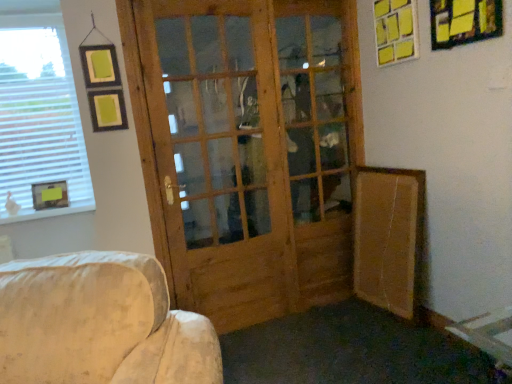
Question: Can you confirm if yellow paper picture frame at upper right, positioned as the second picture frame in bottom-to-top order, is smaller than white blinds at left?

Choices:
 (A) no
 (B) yes

Answer: (B)

Question: Is yellow paper picture frame at upper right, placed as the 1th picture frame when sorted from right to left, positioned in front of white blinds at left?

Choices:
 (A) yes
 (B) no

Answer: (A)

Question: Would you say yellow paper picture frame at upper right, positioned as the 1th picture frame in front-to-back order, is outside white blinds at left?

Choices:
 (A) no
 (B) yes

Answer: (B)

Question: From a real-world perspective, is yellow paper picture frame at upper right, placed as the 1th picture frame when sorted from right to left, beneath white blinds at left?

Choices:
 (A) no
 (B) yes

Answer: (A)

Question: Are yellow paper picture frame at upper right, positioned as the 1th picture frame in front-to-back order, and white blinds at left located far from each other?

Choices:
 (A) no
 (B) yes

Answer: (B)

Question: Does yellow paper picture frame at upper right, positioned as the second picture frame in bottom-to-top order, have a larger size compared to white blinds at left?

Choices:
 (A) yes
 (B) no

Answer: (B)

Question: From a real-world perspective, is natural wood screen door at center over brown cardboard at lower right?

Choices:
 (A) yes
 (B) no

Answer: (A)

Question: From the image's perspective, does natural wood screen door at center appear lower than brown cardboard at lower right?

Choices:
 (A) yes
 (B) no

Answer: (B)

Question: Is natural wood screen door at center shorter than brown cardboard at lower right?

Choices:
 (A) no
 (B) yes

Answer: (A)

Question: Does natural wood screen door at center appear on the right side of brown cardboard at lower right?

Choices:
 (A) no
 (B) yes

Answer: (A)

Question: Is natural wood screen door at center further to the viewer compared to brown cardboard at lower right?

Choices:
 (A) no
 (B) yes

Answer: (A)

Question: Is natural wood screen door at center oriented towards brown cardboard at lower right?

Choices:
 (A) no
 (B) yes

Answer: (A)

Question: Does brown cardboard at lower right contain natural wood screen door at center?

Choices:
 (A) yes
 (B) no

Answer: (B)